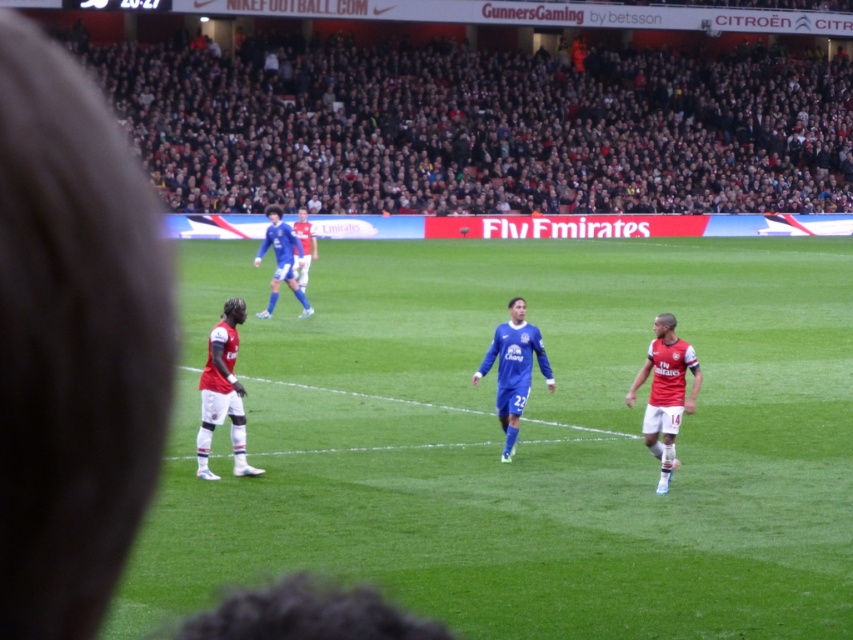
You are a soccer referee positioned at the center of the field. You need to quickly assess if the white jersey at left is within the required 15 meters distance from the blue smooth soccer player at center to avoid an offside call. Can you confirm this?

The distance between the white jersey at left and the blue smooth soccer player at center is 13.24 meters, which is within the 15 meters requirement. Therefore, the white jersey at left is not offside.

You are a soccer player positioned at point (x=222, y=392). What color is the jersey of the player located to your left?

The white jersey at left is located at point (x=222, y=392), so the player to your left is wearing a white jersey.